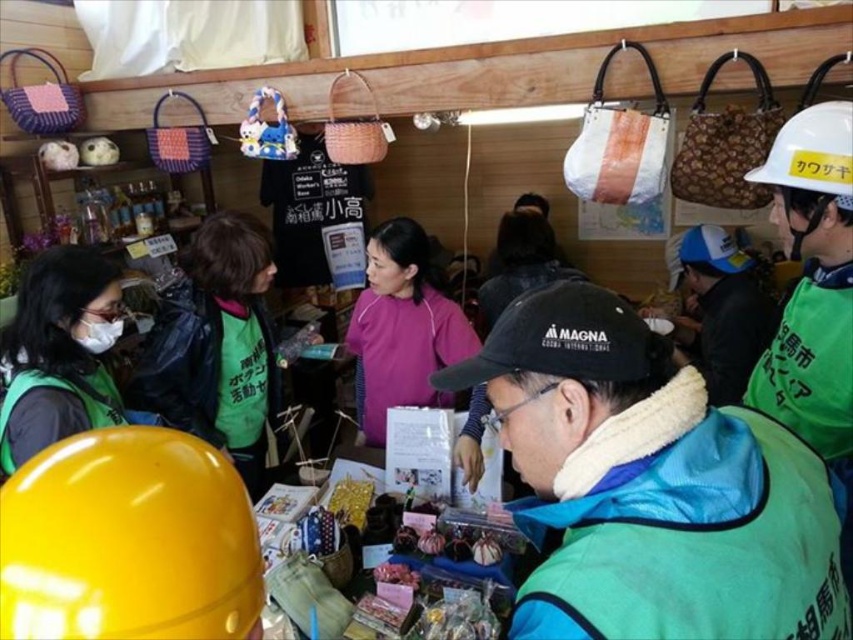
Who is lower down, green fabric vest at left or pink matte shirt at center?

green fabric vest at left is below.

Between green fabric vest at left and pink matte shirt at center, which one has less height?

With less height is pink matte shirt at center.

Is point (271, 365) more distant than point (476, 388)?

That is True.

Where is `green fabric vest at left`? This screenshot has width=853, height=640. green fabric vest at left is located at coordinates (216, 346).

Is point (254, 419) positioned in front of point (97, 330)?

That is False.

Where is `green fabric vest at left`? green fabric vest at left is located at coordinates (216, 346).

Between pink matte shirt at center and white matte mask at left, which one is positioned higher?

Positioned higher is white matte mask at left.

Describe the element at coordinates (402, 328) in the screenshot. This screenshot has width=853, height=640. I see `pink matte shirt at center` at that location.

Which is in front, point (409, 296) or point (115, 321)?

Point (115, 321) is in front.

The height and width of the screenshot is (640, 853). I want to click on pink matte shirt at center, so click(x=402, y=328).